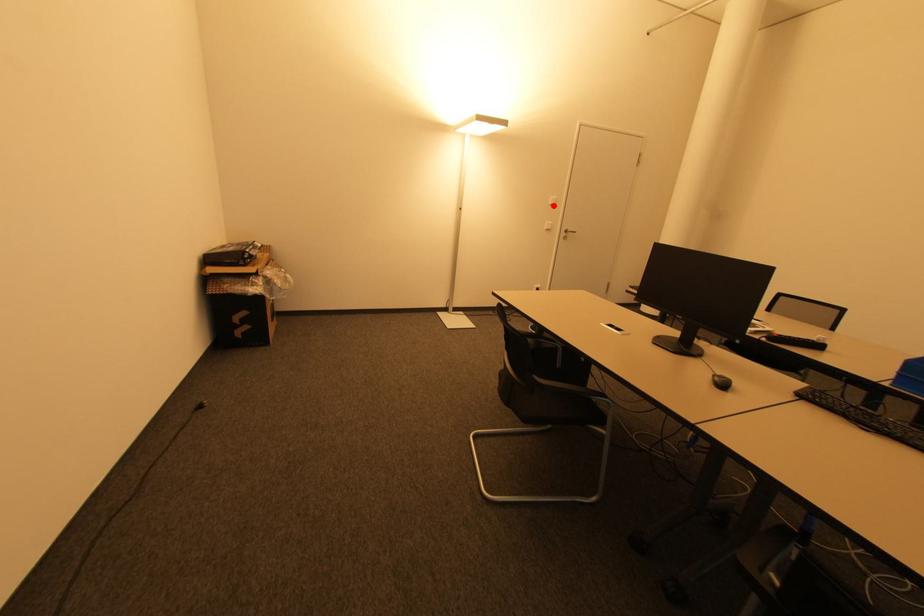
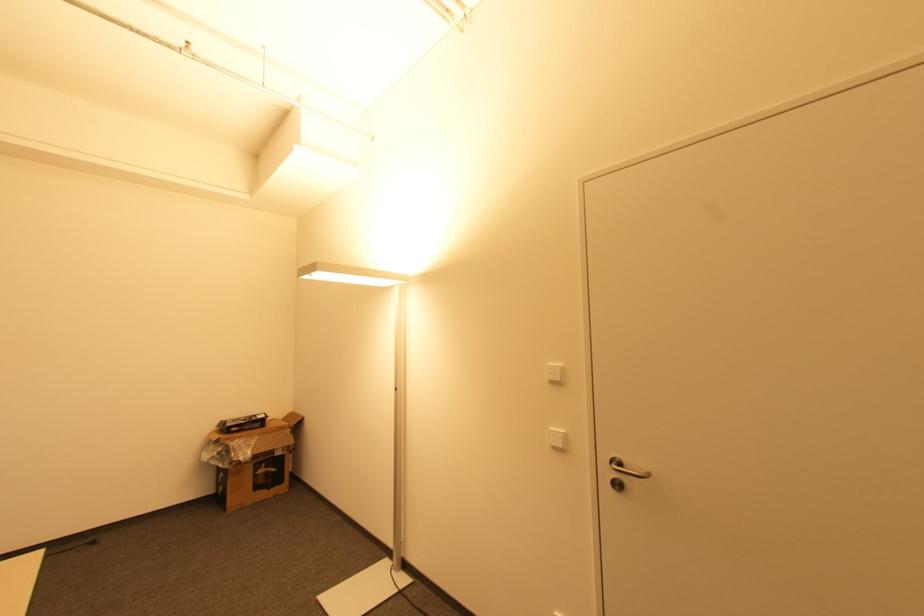
Question: A red point is marked in image1. In image2, is the corresponding 3D point closer to the camera or farther? Reply with the corresponding letter.

Choices:
 (A) The corresponding 3D point is closer.
 (B) The corresponding 3D point is farther.

Answer: (B)